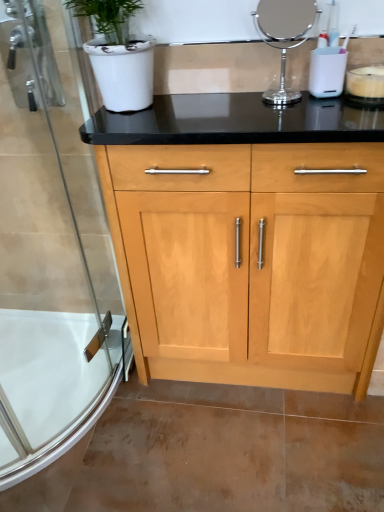
Question: From a real-world perspective, does polished chrome mirror at upper center sit lower than white matte candle at upper right?

Choices:
 (A) yes
 (B) no

Answer: (B)

Question: Does polished chrome mirror at upper center have a greater width compared to white matte candle at upper right?

Choices:
 (A) yes
 (B) no

Answer: (B)

Question: Is the depth of polished chrome mirror at upper center less than that of white matte candle at upper right?

Choices:
 (A) yes
 (B) no

Answer: (A)

Question: From the image's perspective, would you say polished chrome mirror at upper center is positioned over white matte candle at upper right?

Choices:
 (A) yes
 (B) no

Answer: (A)

Question: Is polished chrome mirror at upper center smaller than white matte candle at upper right?

Choices:
 (A) no
 (B) yes

Answer: (A)

Question: Does polished chrome mirror at upper center appear on the left side of white matte candle at upper right?

Choices:
 (A) yes
 (B) no

Answer: (A)

Question: Considering the relative sizes of clear glass shower door at left and polished chrome mirror at upper center in the image provided, is clear glass shower door at left taller than polished chrome mirror at upper center?

Choices:
 (A) no
 (B) yes

Answer: (B)

Question: Is clear glass shower door at left not inside polished chrome mirror at upper center?

Choices:
 (A) no
 (B) yes

Answer: (B)

Question: From the image's perspective, would you say clear glass shower door at left is shown under polished chrome mirror at upper center?

Choices:
 (A) no
 (B) yes

Answer: (B)

Question: Is clear glass shower door at left far away from polished chrome mirror at upper center?

Choices:
 (A) no
 (B) yes

Answer: (A)

Question: From the image's perspective, is clear glass shower door at left on polished chrome mirror at upper center?

Choices:
 (A) no
 (B) yes

Answer: (A)

Question: Is polished chrome mirror at upper center a part of clear glass shower door at left?

Choices:
 (A) no
 (B) yes

Answer: (A)

Question: Is polished chrome mirror at upper center closer to camera compared to white glossy bath at lower left?

Choices:
 (A) no
 (B) yes

Answer: (B)